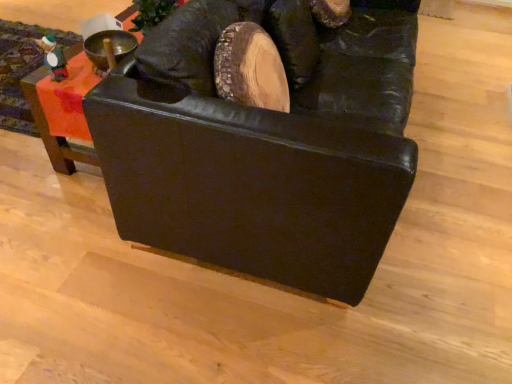
Identify the location of vacant area to the right of black leather couch at center, the second furniture in the left-to-right sequence. (462, 130).